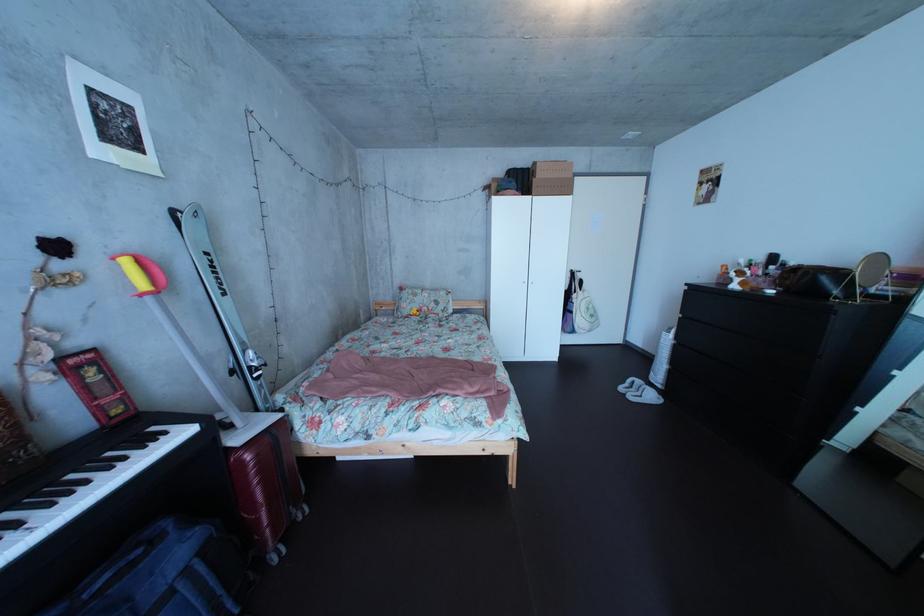
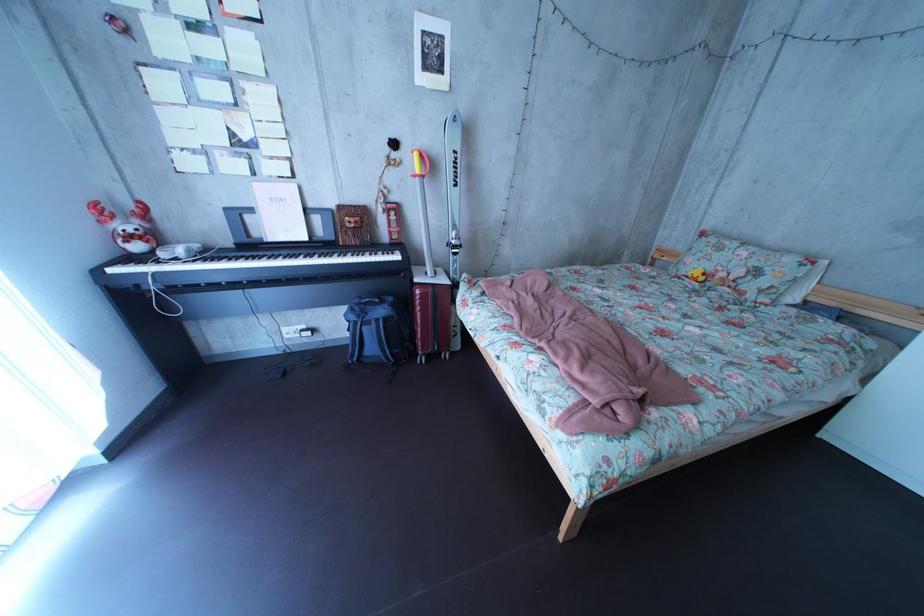
In the second image, find the point that corresponds to point 192,562 in the first image.

(395, 320)